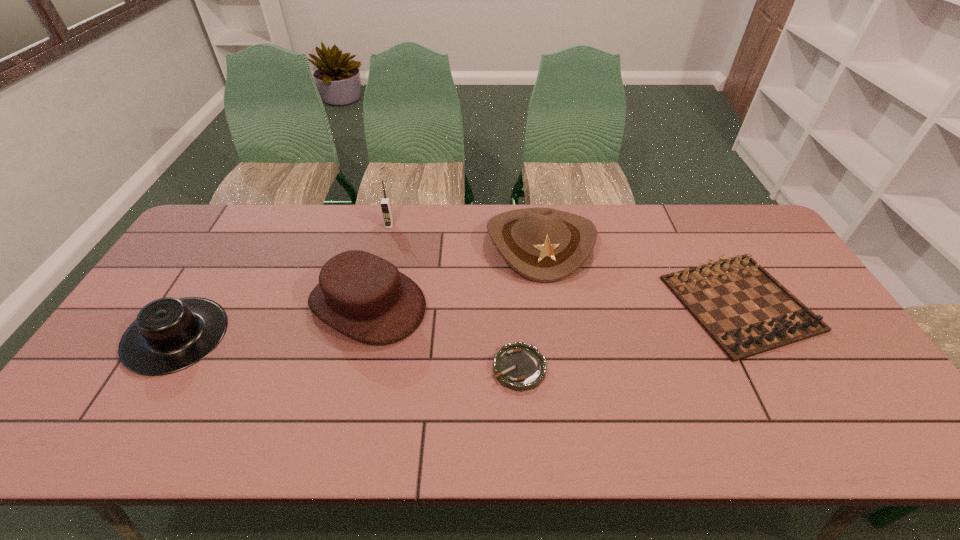
Where is `free location at the far left corner`? The image size is (960, 540). free location at the far left corner is located at coordinates (221, 207).

This screenshot has height=540, width=960. In the image, there is a desktop. In order to click on vacant space at the near left corner in this screenshot , I will do `click(102, 435)`.

At what (x,y) coordinates should I click in order to perform the action: click on free spot at the far right corner of the desktop. Please return your answer as a coordinate pair (x, y). Looking at the image, I should click on (756, 221).

In the image, there is a desktop. In order to click on vacant space at the near right corner in this screenshot , I will do [x=834, y=416].

This screenshot has width=960, height=540. Identify the location of vacant point located between the tallest object and the cowboy hat. (465, 234).

Image resolution: width=960 pixels, height=540 pixels. I want to click on free spot between the fifth tallest object and the taller dress hat, so click(554, 303).

Where is `free point between the chessboard and the taller dress hat`? Image resolution: width=960 pixels, height=540 pixels. free point between the chessboard and the taller dress hat is located at coordinates (554, 303).

Locate an element on the screen. The image size is (960, 540). free space between the tallest object and the ashtray is located at coordinates (454, 296).

Where is `vacant point located between the chessboard and the shorter dress hat`? The height and width of the screenshot is (540, 960). vacant point located between the chessboard and the shorter dress hat is located at coordinates (458, 320).

Identify the location of blank region between the taller dress hat and the cowboy hat. The width and height of the screenshot is (960, 540). (454, 273).